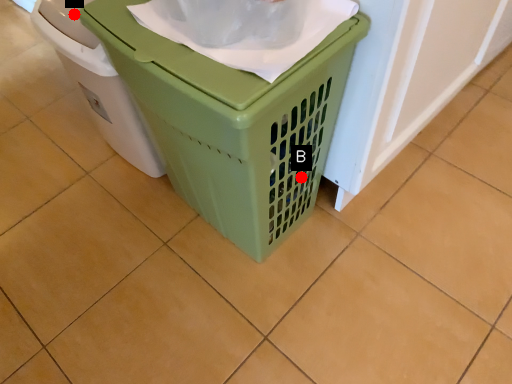
Question: Two points are circled on the image, labeled by A and B beside each circle. Among these points, which one is farthest from the camera?

Choices:
 (A) A is further
 (B) B is further

Answer: (B)